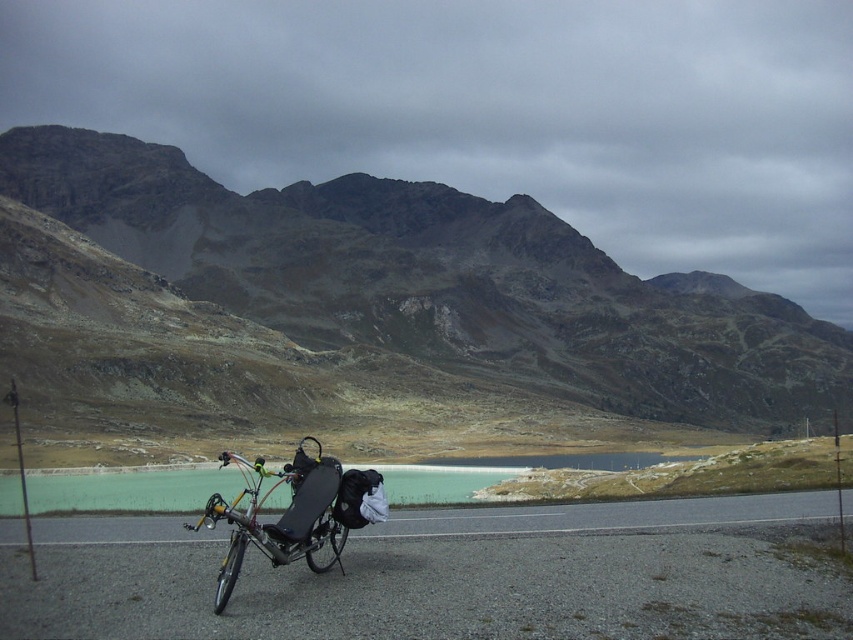
Looking at this image, is green glassy water at center positioned in front of matte black bicycle at center?

No, green glassy water at center is further to the viewer.

Between point (436, 477) and point (207, 524), which one is positioned behind?

Point (436, 477)

Who is more forward, (193, 493) or (273, 472)?

Point (273, 472) is in front.

You are a GUI agent. You are given a task and a screenshot of the screen. Output one action in this format:
    pyautogui.click(x=<x>, y=<y>)
    Task: Click on the green glassy water at center
    The width and height of the screenshot is (853, 640).
    Given the screenshot: What is the action you would take?
    pyautogui.click(x=131, y=490)

Who is more forward, (379, 316) or (178, 493)?

Positioned in front is point (178, 493).

Which of these two, rugged stone mountain at upper center or green glassy water at center, stands taller?

rugged stone mountain at upper center is taller.

Describe the element at coordinates (364, 316) in the screenshot. The width and height of the screenshot is (853, 640). I see `rugged stone mountain at upper center` at that location.

I want to click on rugged stone mountain at upper center, so click(x=364, y=316).

Can you confirm if rugged stone mountain at upper center is thinner than matte black bicycle at center?

Incorrect, rugged stone mountain at upper center's width is not less than matte black bicycle at center's.

Is rugged stone mountain at upper center smaller than matte black bicycle at center?

No.

Is point (463, 243) behind point (308, 438)?

Yes.

This screenshot has height=640, width=853. In order to click on rugged stone mountain at upper center in this screenshot , I will do `click(364, 316)`.